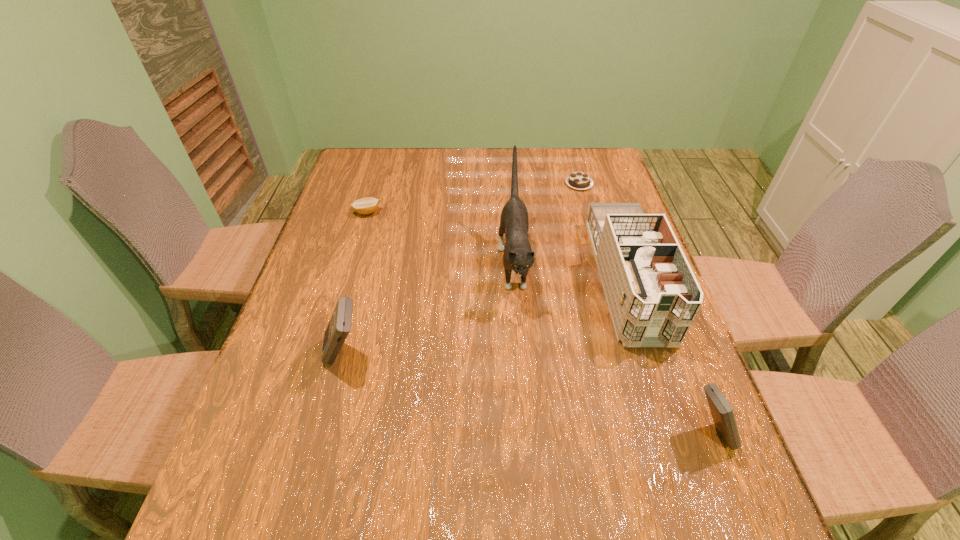
Image resolution: width=960 pixels, height=540 pixels. I want to click on the taller calculator, so click(x=339, y=326).

The image size is (960, 540). In order to click on the farther calculator in this screenshot , I will do tap(339, 326).

Where is `the third shortest object`? The height and width of the screenshot is (540, 960). the third shortest object is located at coordinates (722, 413).

Find the location of a particular element. The width and height of the screenshot is (960, 540). the shorter calculator is located at coordinates (722, 413).

Where is `chocolate cake`? This screenshot has width=960, height=540. chocolate cake is located at coordinates tap(578, 180).

Where is `the shortest object`? The image size is (960, 540). the shortest object is located at coordinates (578, 180).

The height and width of the screenshot is (540, 960). I want to click on the fifth nearest object, so click(x=368, y=205).

Image resolution: width=960 pixels, height=540 pixels. What are the coordinates of `lemon` in the screenshot? It's located at (368, 205).

This screenshot has width=960, height=540. Find the location of `dollhouse`. dollhouse is located at coordinates tap(653, 296).

Locate an element on the screen. The height and width of the screenshot is (540, 960). cat is located at coordinates (518, 256).